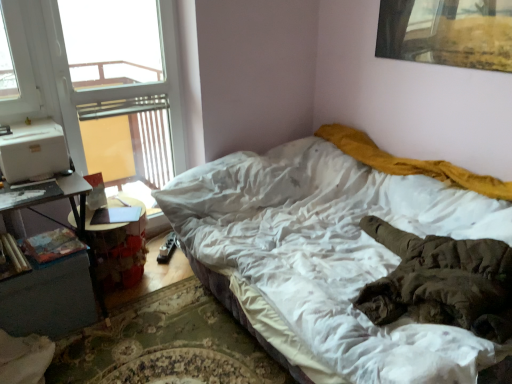
Locate an element on the screen. This screenshot has height=384, width=512. dark gray wood nightstand at lower left is located at coordinates (52, 298).

The width and height of the screenshot is (512, 384). Describe the element at coordinates (52, 298) in the screenshot. I see `dark gray wood nightstand at lower left` at that location.

Find the location of a particular element. This screenshot has width=512, height=384. wooden cylindrical at left, which is the second book from right to left is located at coordinates (12, 258).

What do you see at coordinates (118, 250) in the screenshot? I see `wooden table at left` at bounding box center [118, 250].

Find the location of a particular element. The width and height of the screenshot is (512, 384). dark gray wood nightstand at lower left is located at coordinates (52, 298).

What are the coordinates of `table to the left of white soft bed at center` in the screenshot? It's located at (118, 250).

Is wooden table at left not near white soft bed at center?

That's not correct — wooden table at left is a little close to white soft bed at center.

Does wooden table at left have a greater height compared to white soft bed at center?

In fact, wooden table at left may be shorter than white soft bed at center.

Which is nearer, (109, 280) or (60, 244)?

Clearly, point (109, 280) is more distant from the camera than point (60, 244).

From a real-world perspective, is wooden table at left below hardcover book at lower left, marked as the first book in a right-to-left arrangement?

Yes.

From the image's perspective, is wooden table at left under hardcover book at lower left, acting as the second book starting from the left?

Indeed, from the image's perspective, wooden table at left is shown beneath hardcover book at lower left, acting as the second book starting from the left.

Considering the sizes of hardcover book at lower left, marked as the first book in a right-to-left arrangement, and dark gray wood nightstand at lower left in the image, is hardcover book at lower left, marked as the first book in a right-to-left arrangement, taller or shorter than dark gray wood nightstand at lower left?

Clearly, hardcover book at lower left, marked as the first book in a right-to-left arrangement, is shorter compared to dark gray wood nightstand at lower left.

Considering the relative sizes of hardcover book at lower left, acting as the second book starting from the left, and dark gray wood nightstand at lower left in the image provided, is hardcover book at lower left, acting as the second book starting from the left, wider than dark gray wood nightstand at lower left?

No.

From a real-world perspective, is hardcover book at lower left, acting as the second book starting from the left, under dark gray wood nightstand at lower left?

Incorrect, from a real-world perspective, hardcover book at lower left, acting as the second book starting from the left, is higher than dark gray wood nightstand at lower left.

Which is more to the left, hardcover book at lower left, acting as the second book starting from the left, or dark gray wood nightstand at lower left?

dark gray wood nightstand at lower left is more to the left.

From the image's perspective, is dark gray wood nightstand at lower left above hardcover book at lower left, marked as the first book in a right-to-left arrangement?

No, from the image's perspective, dark gray wood nightstand at lower left is not on top of hardcover book at lower left, marked as the first book in a right-to-left arrangement.

Can you confirm if dark gray wood nightstand at lower left is wider than hardcover book at lower left, acting as the second book starting from the left?

Indeed, dark gray wood nightstand at lower left has a greater width compared to hardcover book at lower left, acting as the second book starting from the left.

Is dark gray wood nightstand at lower left at the left side of hardcover book at lower left, marked as the first book in a right-to-left arrangement?

Indeed, dark gray wood nightstand at lower left is positioned on the left side of hardcover book at lower left, marked as the first book in a right-to-left arrangement.

Is wooden table at left far from dark gray wood nightstand at lower left?

wooden table at left is near dark gray wood nightstand at lower left, not far away.

Between wooden table at left and dark gray wood nightstand at lower left, which one has smaller width?

dark gray wood nightstand at lower left is thinner.

Based on the photo, measure the distance between wooden table at left and dark gray wood nightstand at lower left.

They are 7.66 inches apart.

From a real-world perspective, relative to dark gray wood nightstand at lower left, is wooden table at left vertically above or below?

Clearly, from a real-world perspective, wooden table at left is above dark gray wood nightstand at lower left.

Which point is more distant from viewer, (481, 220) or (93, 254)?

The point (93, 254) is farther from the camera.

Can you confirm if white soft bed at center is positioned to the left of dark gray wood nightstand at lower left?

No, white soft bed at center is not to the left of dark gray wood nightstand at lower left.

Is dark gray wood nightstand at lower left located within white soft bed at center?

No, dark gray wood nightstand at lower left is not inside white soft bed at center.

From the picture: Would you say white soft bed at center is a long distance from dark gray wood nightstand at lower left?

Yes, white soft bed at center and dark gray wood nightstand at lower left are located far from each other.

Can you confirm if wooden cylindrical at left, which is the second book from right to left, is positioned to the left of white soft bed at center?

Yes.

Relative to white soft bed at center, is wooden cylindrical at left, which is the second book from right to left, in front or behind?

→ Clearly, wooden cylindrical at left, which is the second book from right to left, is behind white soft bed at center.

From the picture: Between wooden cylindrical at left, the first book from the left, and white soft bed at center, which one has less height?

wooden cylindrical at left, the first book from the left, is shorter.

Locate an element on the screen. The height and width of the screenshot is (384, 512). bed on the right of wooden table at left is located at coordinates (333, 251).

In order to click on table lying below the hardcover book at lower left, marked as the first book in a right-to-left arrangement (from the image's perspective) in this screenshot , I will do `click(118, 250)`.

Which object lies nearer to the anchor point white soft bed at center, dark gray wood nightstand at lower left or transparent glass window at upper left?

dark gray wood nightstand at lower left lies closer to white soft bed at center than the other object.

Based on the photo, from the image, which object appears to be farther from wooden cylindrical at left, which is the second book from right to left, hardcover book at lower left, marked as the first book in a right-to-left arrangement, or transparent glass window at upper left?

Based on the image, transparent glass window at upper left appears to be further to wooden cylindrical at left, which is the second book from right to left.

Looking at the image, which one is located closer to transparent glass window at upper left, wooden cylindrical at left, the first book from the left, or white soft bed at center?

wooden cylindrical at left, the first book from the left, is closer to transparent glass window at upper left.

Consider the image. Which object lies nearer to the anchor point wooden table at left, transparent glass window at upper left or hardcover book at lower left, acting as the second book starting from the left?

Based on the image, hardcover book at lower left, acting as the second book starting from the left, appears to be nearer to wooden table at left.

When comparing their distances from white soft bed at center, does wooden cylindrical at left, which is the second book from right to left, or dark gray wood nightstand at lower left seem further?

Among the two, wooden cylindrical at left, which is the second book from right to left, is located further to white soft bed at center.

Considering their positions, is hardcover book at lower left, acting as the second book starting from the left, positioned further to wooden table at left than wooden cylindrical at left, which is the second book from right to left?

wooden cylindrical at left, which is the second book from right to left, lies further to wooden table at left than the other object.

Consider the image. From the image, which object appears to be nearer to wooden table at left, hardcover book at lower left, acting as the second book starting from the left, or transparent glass window at upper left?

Among the two, hardcover book at lower left, acting as the second book starting from the left, is located nearer to wooden table at left.

Estimate the real-world distances between objects in this image. Which object is further from transparent glass window at upper left, dark gray wood nightstand at lower left or wooden cylindrical at left, the first book from the left?

wooden cylindrical at left, the first book from the left, is further to transparent glass window at upper left.

Locate an element on the screen. window between wooden cylindrical at left, the first book from the left, and white soft bed at center is located at coordinates (70, 78).

Image resolution: width=512 pixels, height=384 pixels. In order to click on table between transparent glass window at upper left and dark gray wood nightstand at lower left from top to bottom in this screenshot , I will do [x=118, y=250].

Image resolution: width=512 pixels, height=384 pixels. I want to click on book between wooden cylindrical at left, the first book from the left, and wooden table at left from left to right, so click(x=52, y=245).

Find the location of a particular element. The width and height of the screenshot is (512, 384). window between hardcover book at lower left, marked as the first book in a right-to-left arrangement, and white soft bed at center is located at coordinates (70, 78).